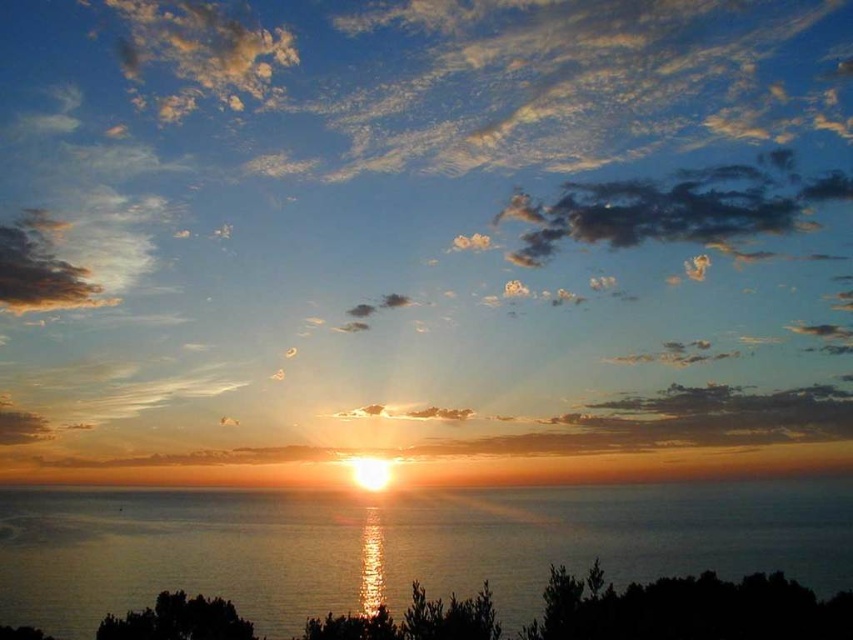
Question: Which of the following is the closest to the observer?

Choices:
 (A) golden translucent cloud at center
 (B) glistening silver water at center

Answer: (B)

Question: Can you confirm if glistening silver water at center is positioned to the left of dark gray fluffy cloud at upper center?

Choices:
 (A) no
 (B) yes

Answer: (B)

Question: Can you confirm if golden translucent cloud at center is thinner than dark gray fluffy cloud at upper center?

Choices:
 (A) yes
 (B) no

Answer: (B)

Question: Which is nearer to the dark gray fluffy cloud at upper center?

Choices:
 (A) glistening silver water at center
 (B) golden translucent cloud at center

Answer: (B)

Question: Which object is the closest to the glistening silver water at center?

Choices:
 (A) dark gray fluffy cloud at upper center
 (B) golden translucent cloud at center

Answer: (B)

Question: Is golden translucent cloud at center wider than glistening silver water at center?

Choices:
 (A) yes
 (B) no

Answer: (A)